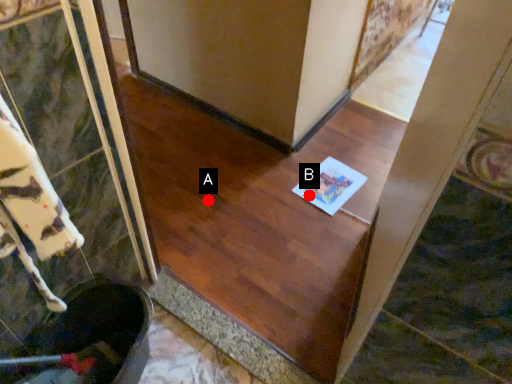
Question: Two points are circled on the image, labeled by A and B beside each circle. Which of the following is the closest to the observer?

Choices:
 (A) A is closer
 (B) B is closer

Answer: (A)